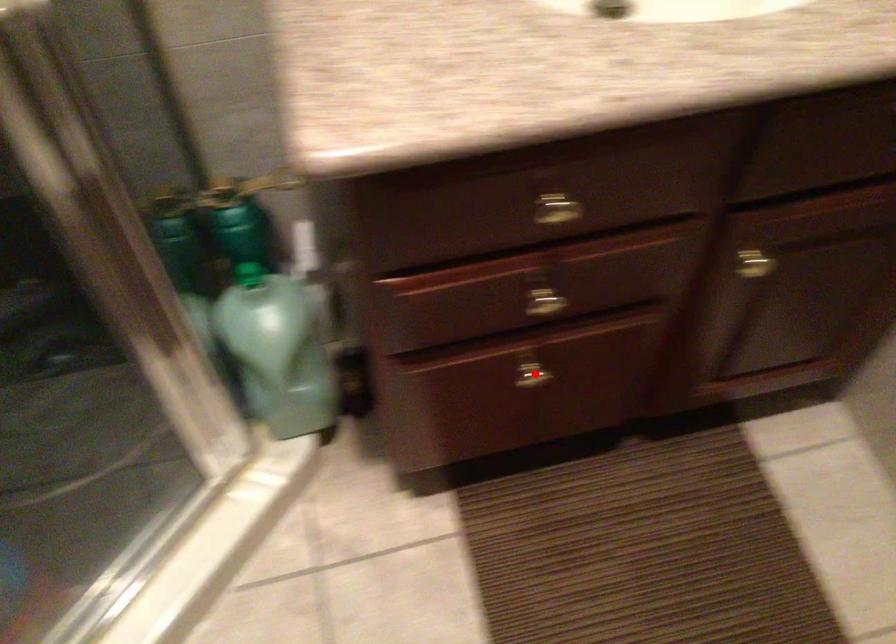
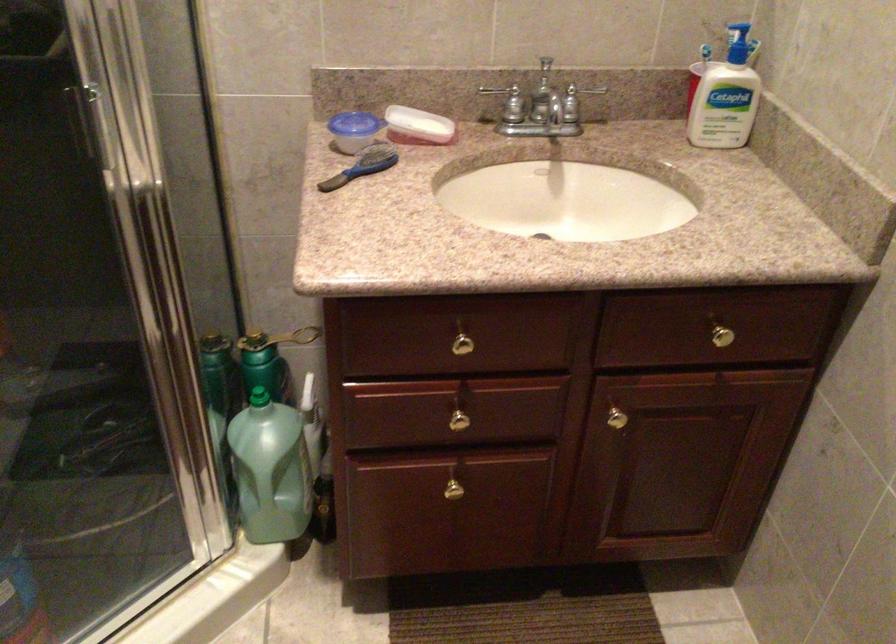
Where in the second image is the point corresponding to the highlighted location from the first image?

(455, 488)